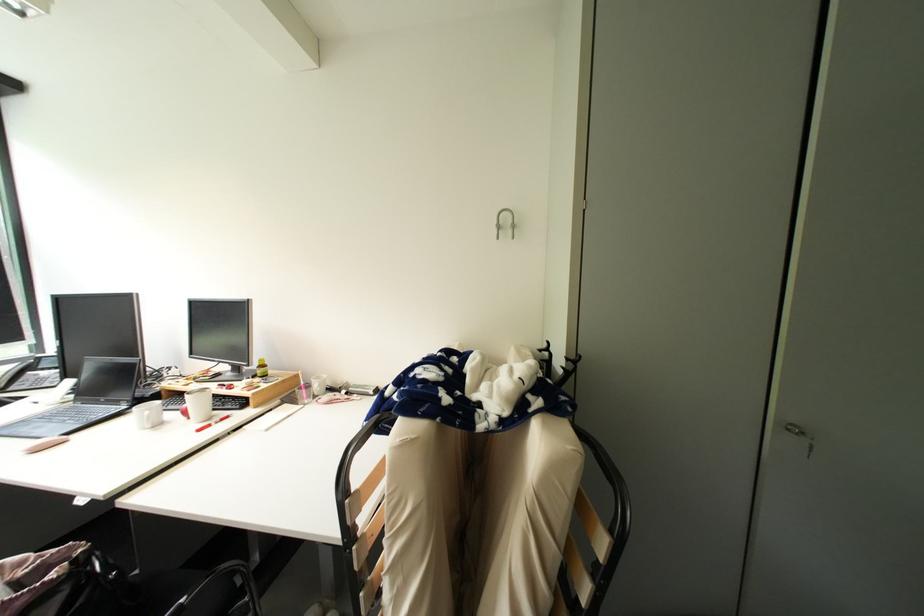
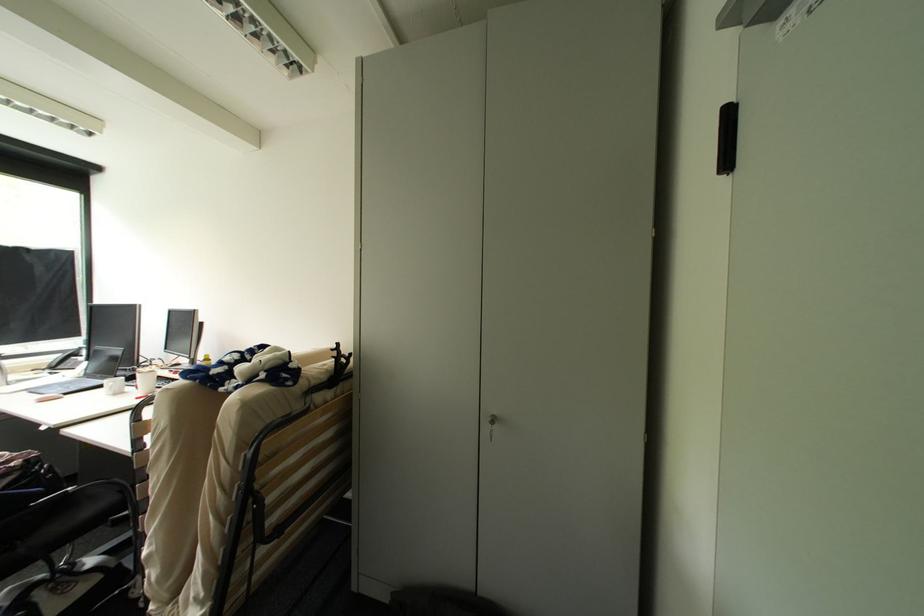
Where in the second image is the point corresponding to (x=186, y=414) from the first image?

(141, 387)